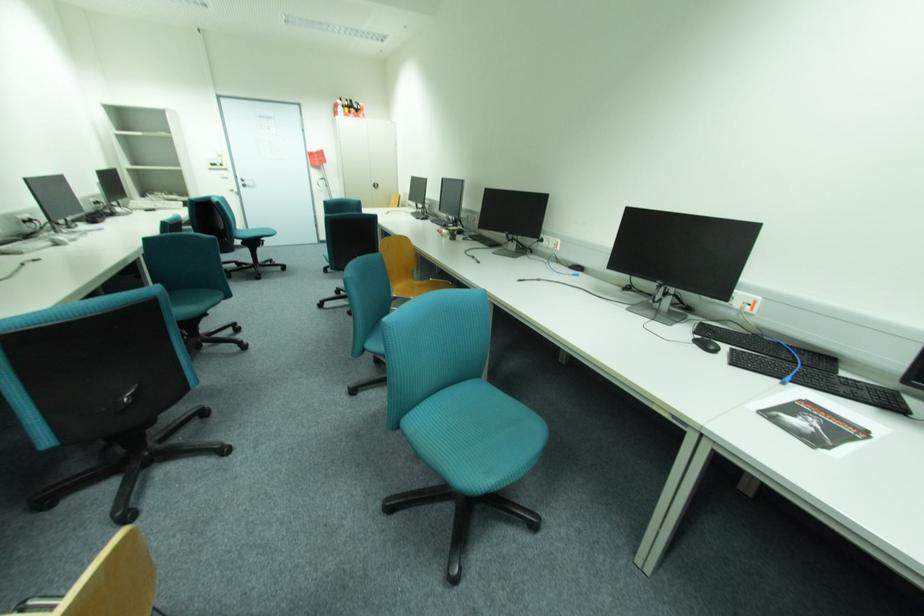
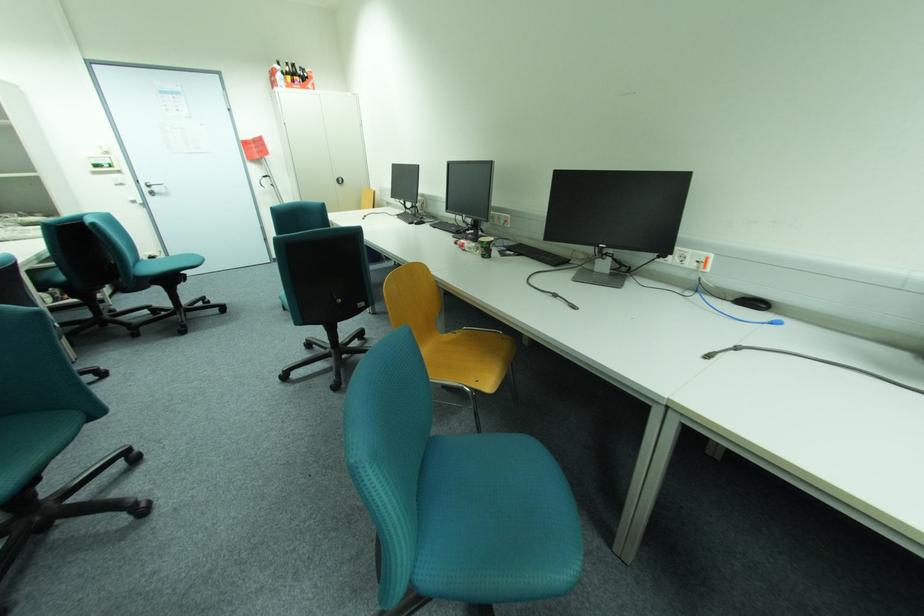
The images are taken continuously from a first-person perspective. In which direction are you moving?

The cameraman moved toward left, forward.